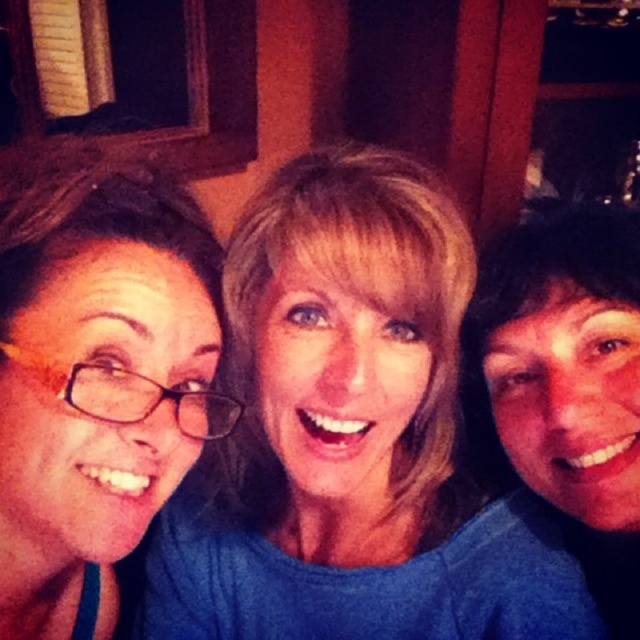
Question: Considering the relative positions of blue fabric shirt at center and matte blue shirt at center in the image provided, where is blue fabric shirt at center located with respect to matte blue shirt at center?

Choices:
 (A) below
 (B) above

Answer: (B)

Question: Which of these objects is positioned farthest from the yellow-framed glasses at left?

Choices:
 (A) matte blue shirt at center
 (B) blue fabric shirt at center

Answer: (A)

Question: Among these objects, which one is nearest to the camera?

Choices:
 (A) blue fabric shirt at center
 (B) yellow-framed glasses at left

Answer: (A)

Question: Which point is farther from the camera taking this photo?

Choices:
 (A) (465, 314)
 (B) (29, 516)
 (C) (349, 170)

Answer: (A)

Question: Can you confirm if yellow-framed glasses at left is positioned to the right of matte blue shirt at center?

Choices:
 (A) no
 (B) yes

Answer: (A)

Question: Is blue fabric shirt at center to the right of yellow-framed glasses at left from the viewer's perspective?

Choices:
 (A) yes
 (B) no

Answer: (A)